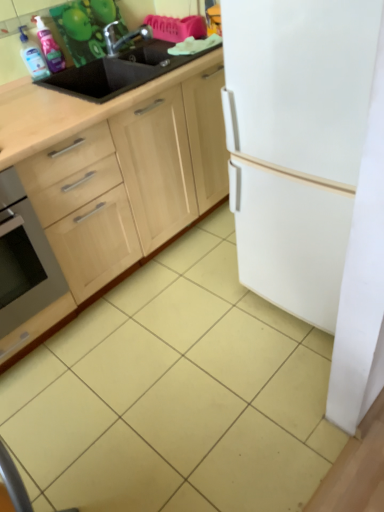
Question: From the image's perspective, is stainless steel oven at lower left on top of translucent plastic spray bottle at upper left, marked as the first cleaning product in a right-to-left arrangement?

Choices:
 (A) no
 (B) yes

Answer: (A)

Question: Is stainless steel oven at lower left far from translucent plastic spray bottle at upper left, marked as the 2th cleaning product in a left-to-right arrangement?

Choices:
 (A) yes
 (B) no

Answer: (B)

Question: From the image's perspective, would you say stainless steel oven at lower left is shown under translucent plastic spray bottle at upper left, marked as the 2th cleaning product in a left-to-right arrangement?

Choices:
 (A) no
 (B) yes

Answer: (B)

Question: Can you confirm if stainless steel oven at lower left is wider than translucent plastic spray bottle at upper left, marked as the 2th cleaning product in a left-to-right arrangement?

Choices:
 (A) no
 (B) yes

Answer: (B)

Question: Is stainless steel oven at lower left bigger than translucent plastic spray bottle at upper left, marked as the first cleaning product in a right-to-left arrangement?

Choices:
 (A) no
 (B) yes

Answer: (B)

Question: Is stainless steel oven at lower left next to translucent plastic spray bottle at upper left, marked as the 2th cleaning product in a left-to-right arrangement, and touching it?

Choices:
 (A) no
 (B) yes

Answer: (A)

Question: Is translucent plastic bottle at upper left, the second cleaning product when ordered from right to left, oriented towards stainless steel oven at lower left?

Choices:
 (A) no
 (B) yes

Answer: (A)

Question: Is translucent plastic bottle at upper left, which appears as the 1th cleaning product when viewed from the left, smaller than stainless steel oven at lower left?

Choices:
 (A) no
 (B) yes

Answer: (B)

Question: Is translucent plastic bottle at upper left, which appears as the 1th cleaning product when viewed from the left, far from stainless steel oven at lower left?

Choices:
 (A) no
 (B) yes

Answer: (A)

Question: Does translucent plastic bottle at upper left, which appears as the 1th cleaning product when viewed from the left, come in front of stainless steel oven at lower left?

Choices:
 (A) no
 (B) yes

Answer: (A)

Question: From a real-world perspective, is translucent plastic bottle at upper left, which appears as the 1th cleaning product when viewed from the left, physically above stainless steel oven at lower left?

Choices:
 (A) yes
 (B) no

Answer: (A)

Question: Is translucent plastic bottle at upper left, the second cleaning product when ordered from right to left, in contact with stainless steel oven at lower left?

Choices:
 (A) no
 (B) yes

Answer: (A)

Question: From the image's perspective, would you say wooden cabinet at center is shown under white matte refrigerator at right?

Choices:
 (A) yes
 (B) no

Answer: (A)